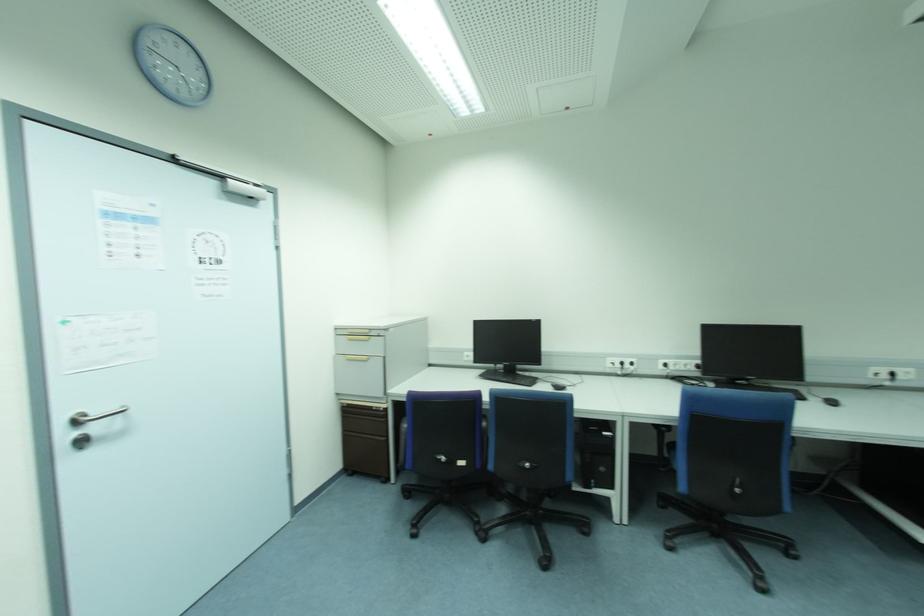
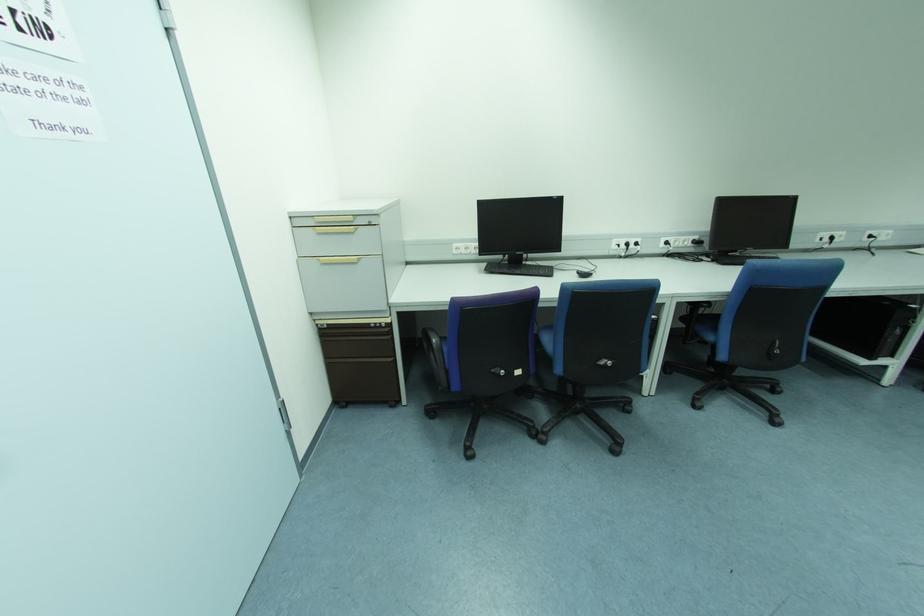
Locate, in the second image, the point that corresponds to [438,459] in the first image.

(494, 374)